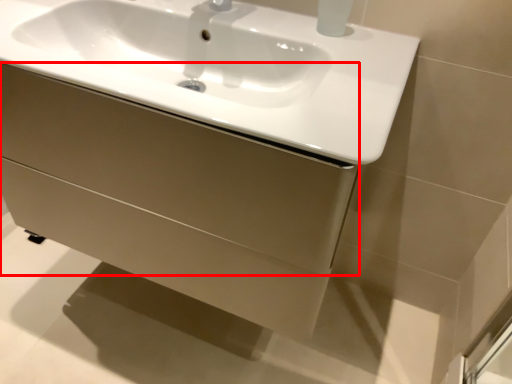
Question: From the image's perspective, what is the correct spatial positioning of drawer (annotated by the red box) in reference to sink?

Choices:
 (A) above
 (B) below

Answer: (B)